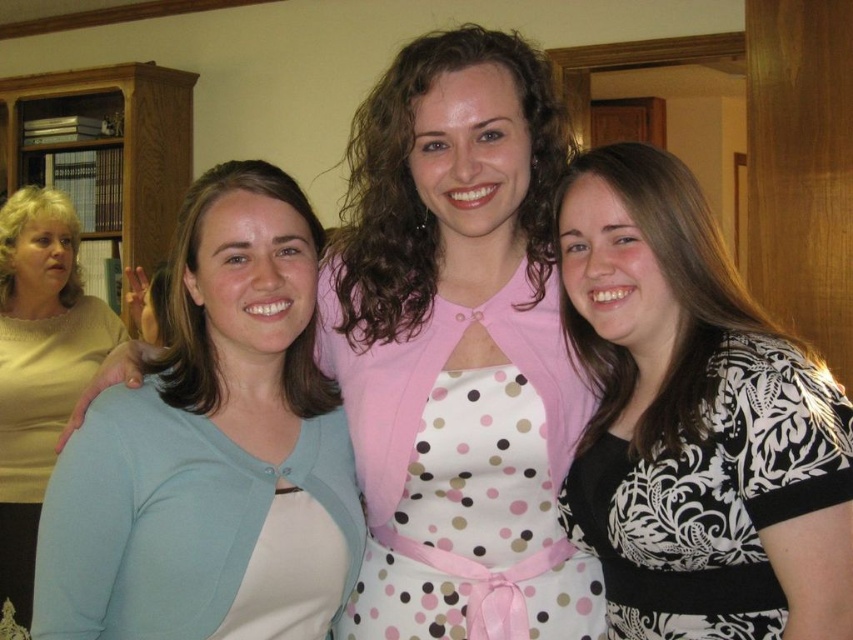
Question: Which of the following is the closest to the observer?

Choices:
 (A) light blue fabric at left
 (B) pink polka dot dress at center

Answer: (A)

Question: Considering the real-world distances, which object is farthest from the matte yellow sweater at left?

Choices:
 (A) pink fabric dress at center
 (B) light blue fabric at left

Answer: (A)

Question: Does black and white patterned blouse at right lie behind light blue fabric at left?

Choices:
 (A) no
 (B) yes

Answer: (A)

Question: Is light blue fabric at left bigger than matte yellow sweater at left?

Choices:
 (A) yes
 (B) no

Answer: (B)

Question: Which point is closer to the camera?

Choices:
 (A) (550, 212)
 (B) (106, 420)
 (C) (10, 392)

Answer: (B)

Question: Observing the image, what is the correct spatial positioning of light blue fabric at left in reference to polka dot apron at center?

Choices:
 (A) above
 (B) below

Answer: (A)